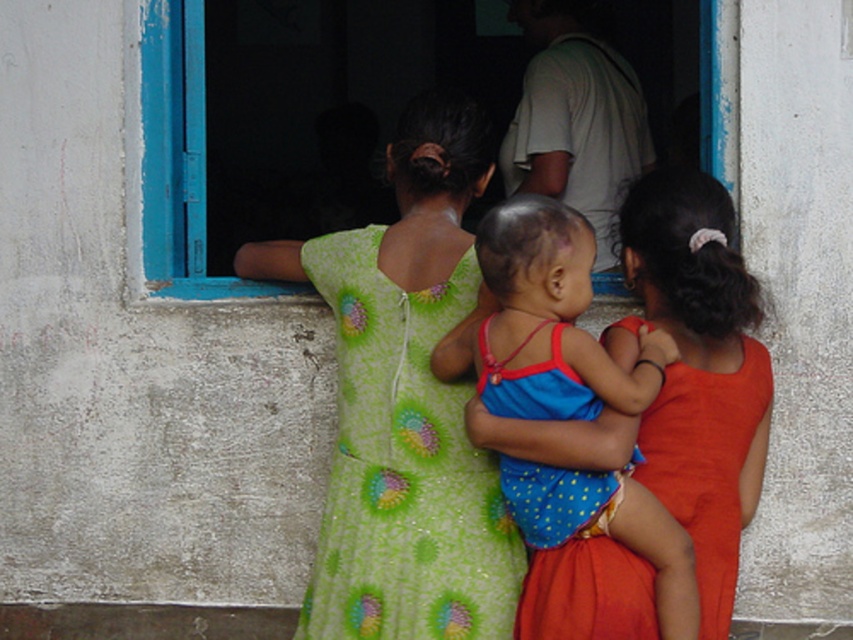
You are standing 10 feet away from the window. You want to reach the green printed fabric dress at center to hand over a document. Can you do it without moving closer?

The green printed fabric dress at center is 12.17 feet away from the viewer, which is farther than your current position of 10 feet. Therefore, you cannot reach it without moving closer.